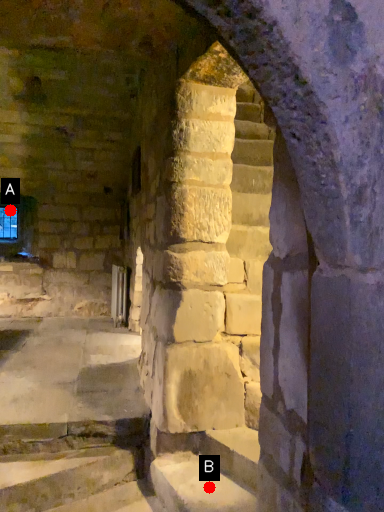
Question: Two points are circled on the image, labeled by A and B beside each circle. Which of the following is the farthest from the observer?

Choices:
 (A) A is further
 (B) B is further

Answer: (A)